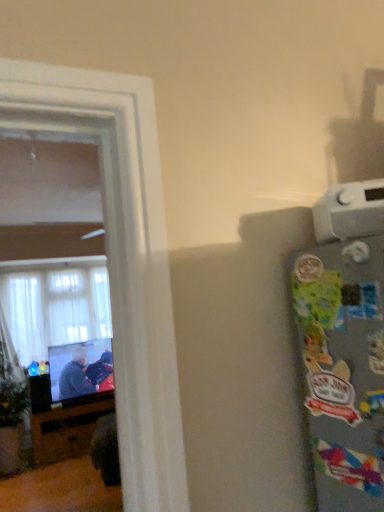
Question: From a real-world perspective, is green matte plant at left beneath white plastic thermostat at upper right?

Choices:
 (A) no
 (B) yes

Answer: (B)

Question: Considering the relative sizes of green matte plant at left and white plastic thermostat at upper right in the image provided, is green matte plant at left shorter than white plastic thermostat at upper right?

Choices:
 (A) no
 (B) yes

Answer: (A)

Question: Considering the relative sizes of green matte plant at left and white plastic thermostat at upper right in the image provided, is green matte plant at left bigger than white plastic thermostat at upper right?

Choices:
 (A) yes
 (B) no

Answer: (A)

Question: From a real-world perspective, is green matte plant at left on top of white plastic thermostat at upper right?

Choices:
 (A) yes
 (B) no

Answer: (B)

Question: Is green matte plant at left surrounding white plastic thermostat at upper right?

Choices:
 (A) no
 (B) yes

Answer: (A)

Question: Are green matte plant at left and white plastic thermostat at upper right making contact?

Choices:
 (A) no
 (B) yes

Answer: (A)

Question: Is dark gray sweater at left placed right next to green matte plant at left?

Choices:
 (A) yes
 (B) no

Answer: (B)

Question: Can you confirm if dark gray sweater at left is shorter than green matte plant at left?

Choices:
 (A) no
 (B) yes

Answer: (B)

Question: Is green matte plant at left completely or partially inside dark gray sweater at left?

Choices:
 (A) yes
 (B) no

Answer: (B)

Question: Is the depth of dark gray sweater at left less than that of green matte plant at left?

Choices:
 (A) yes
 (B) no

Answer: (B)

Question: Is dark gray sweater at left thinner than green matte plant at left?

Choices:
 (A) no
 (B) yes

Answer: (B)

Question: Is dark gray sweater at left turned away from green matte plant at left?

Choices:
 (A) yes
 (B) no

Answer: (B)

Question: Is white sheer curtains at left bigger than black glossy entertainment center at left?

Choices:
 (A) yes
 (B) no

Answer: (A)